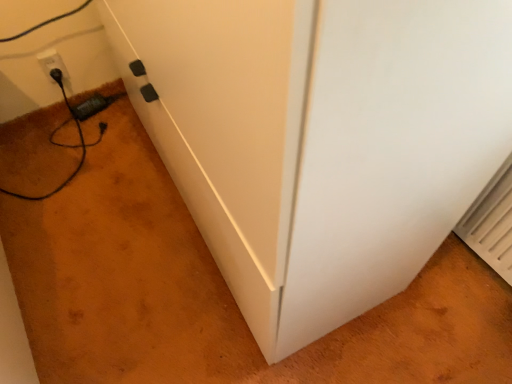
Locate an element on the screen. Image resolution: width=512 pixels, height=384 pixels. black plastic plug at lower left is located at coordinates (94, 105).

What do you see at coordinates (94, 105) in the screenshot?
I see `black plastic plug at lower left` at bounding box center [94, 105].

The image size is (512, 384). What do you see at coordinates (52, 63) in the screenshot?
I see `white plastic outlet at lower left` at bounding box center [52, 63].

What is the approximate width of white plastic outlet at lower left?

The width of white plastic outlet at lower left is 2.89 centimeters.

Find the location of a particular element. This screenshot has width=512, height=384. white plastic outlet at lower left is located at coordinates (52, 63).

I want to click on black plastic plug at lower left, so click(94, 105).

Between black plastic plug at lower left and white plastic outlet at lower left, which one appears on the left side from the viewer's perspective?

white plastic outlet at lower left.

Which object is further away from the camera taking this photo, black plastic plug at lower left or white plastic outlet at lower left?

Positioned behind is black plastic plug at lower left.

Does point (104, 96) appear closer or farther from the camera than point (61, 62)?

Point (104, 96) is farther from the camera than point (61, 62).

From the image's perspective, is black plastic plug at lower left located above white plastic outlet at lower left?

Actually, black plastic plug at lower left appears below white plastic outlet at lower left in the image.

Consider the image. From a real-world perspective, relative to white plastic outlet at lower left, is black plastic plug at lower left vertically above or below?

black plastic plug at lower left is situated lower than white plastic outlet at lower left in the real world.

Is black plastic plug at lower left wider than white plastic outlet at lower left?

Correct, the width of black plastic plug at lower left exceeds that of white plastic outlet at lower left.

Looking at this image, who is shorter, black plastic plug at lower left or white plastic outlet at lower left?

With less height is black plastic plug at lower left.

Can you confirm if black plastic plug at lower left is smaller than white plastic outlet at lower left?

Actually, black plastic plug at lower left might be larger than white plastic outlet at lower left.

Is black plastic plug at lower left spatially inside white plastic outlet at lower left, or outside of it?

black plastic plug at lower left lies outside white plastic outlet at lower left.

Can you see black plastic plug at lower left touching white plastic outlet at lower left?

black plastic plug at lower left and white plastic outlet at lower left are not in contact.

Is black plastic plug at lower left oriented towards white plastic outlet at lower left?

No, black plastic plug at lower left is not aimed at white plastic outlet at lower left.

This screenshot has height=384, width=512. Find the location of `electric outlet above the black plastic plug at lower left (from the image's perspective)`. electric outlet above the black plastic plug at lower left (from the image's perspective) is located at coordinates (52, 63).

Which is more to the left, white plastic outlet at lower left or black plastic plug at lower left?

Positioned to the left is white plastic outlet at lower left.

Which object is further away from the camera, white plastic outlet at lower left or black plastic plug at lower left?

Positioned behind is black plastic plug at lower left.

Which is closer to the camera, (47, 74) or (91, 106)?

Point (47, 74) is positioned closer to the camera compared to point (91, 106).

From the image's perspective, is white plastic outlet at lower left located above or below black plastic plug at lower left?

Based on their image positions, white plastic outlet at lower left is located above black plastic plug at lower left.

From a real-world perspective, is white plastic outlet at lower left above or below black plastic plug at lower left?

Clearly, from a real-world perspective, white plastic outlet at lower left is above black plastic plug at lower left.

Is white plastic outlet at lower left wider or thinner than black plastic plug at lower left?

white plastic outlet at lower left is thinner than black plastic plug at lower left.

Considering the sizes of objects white plastic outlet at lower left and black plastic plug at lower left in the image provided, who is taller, white plastic outlet at lower left or black plastic plug at lower left?

Standing taller between the two is white plastic outlet at lower left.

Between white plastic outlet at lower left and black plastic plug at lower left, which one has larger size?

black plastic plug at lower left is bigger.

Is white plastic outlet at lower left surrounding black plastic plug at lower left?

No, black plastic plug at lower left is not inside white plastic outlet at lower left.

From the picture: Are white plastic outlet at lower left and black plastic plug at lower left far apart?

No, white plastic outlet at lower left is not far from black plastic plug at lower left.

Could you tell me if white plastic outlet at lower left is turned towards black plastic plug at lower left?

No, white plastic outlet at lower left is not facing towards black plastic plug at lower left.

What's the angular difference between white plastic outlet at lower left and black plastic plug at lower left's facing directions?

The facing directions of white plastic outlet at lower left and black plastic plug at lower left are 13.7 degrees apart.

Find the location of a particular element. This screenshot has width=512, height=384. electric outlet above the black plastic plug at lower left (from a real-world perspective) is located at coordinates (52, 63).

This screenshot has width=512, height=384. Identify the location of electric outlet that appears on the left of black plastic plug at lower left. (52, 63).

What are the coordinates of `plug on the right side of white plastic outlet at lower left` in the screenshot? It's located at (94, 105).